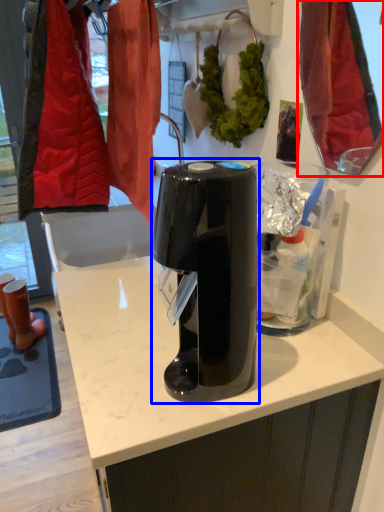
Question: Which of the following is the farthest to the observer, mirror (highlighted by a red box) or home appliance (highlighted by a blue box)?

Choices:
 (A) mirror
 (B) home appliance

Answer: (A)